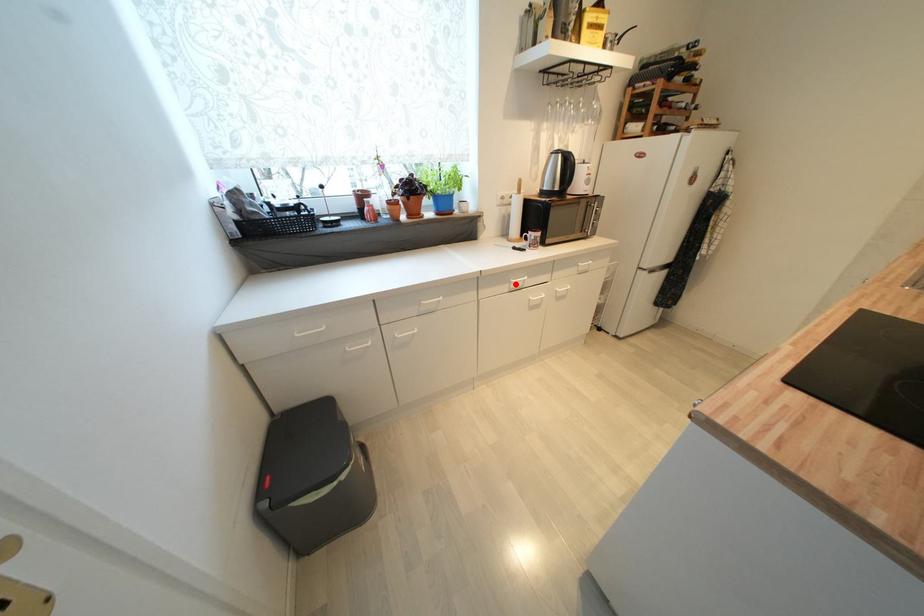
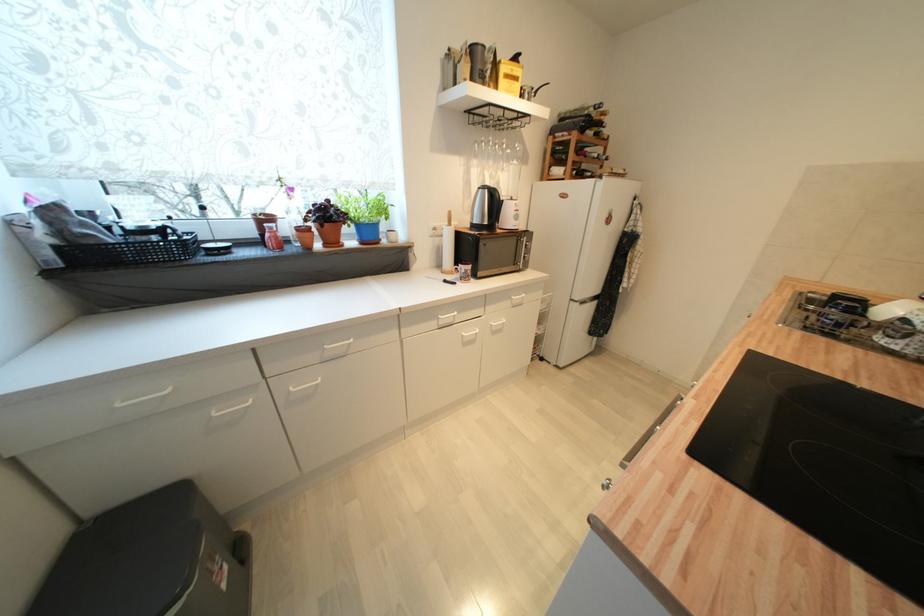
Question: I am providing you with two images of the same scene from different viewpoints. A red point is marked on the first image. Can you still see the location of the red point in image 2?

Choices:
 (A) Yes
 (B) No

Answer: (A)